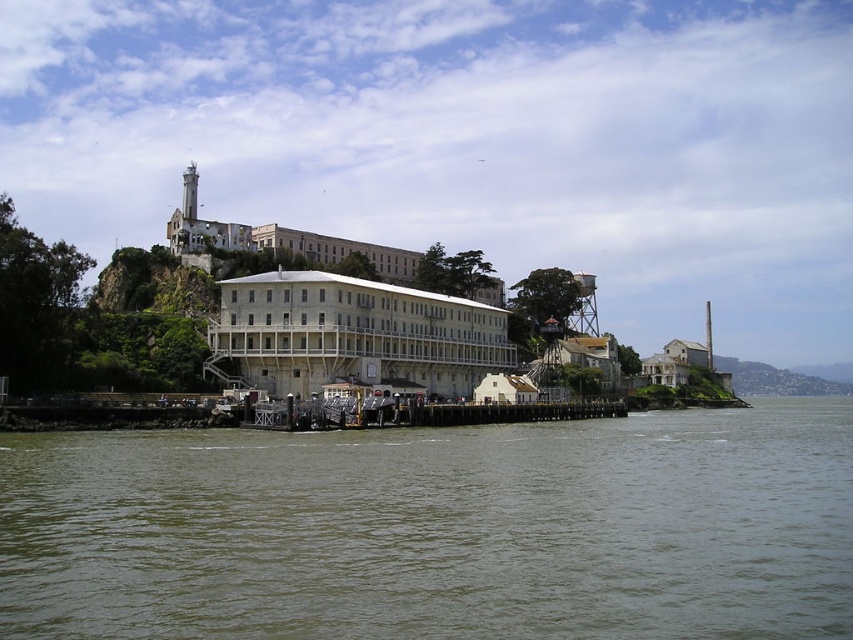
Can you confirm if greenish water at lower center is positioned to the left of white painted wood building at center?

No, greenish water at lower center is not to the left of white painted wood building at center.

Who is lower down, greenish water at lower center or white painted wood building at center?

Positioned lower is greenish water at lower center.

Where is `greenish water at lower center`? The height and width of the screenshot is (640, 853). greenish water at lower center is located at coordinates (438, 529).

Who is more distant from viewer, (360, 304) or (200, 240)?

The point (200, 240) is more distant.

Between white painted wood building at center and white concrete building at center, which one has less height?

white painted wood building at center is shorter.

Is point (244, 317) in front of point (178, 252)?

Yes, it is in front of point (178, 252).

You are a GUI agent. You are given a task and a screenshot of the screen. Output one action in this format:
    pyautogui.click(x=<x>, y=<y>)
    Task: Click on the white painted wood building at center
    
    Given the screenshot: What is the action you would take?
    pyautogui.click(x=352, y=333)

Which is above, greenish water at lower center or white concrete building at center?

Positioned higher is white concrete building at center.

In the scene shown: Who is more forward, (508, 586) or (314, 257)?

Point (508, 586) is in front.

The image size is (853, 640). I want to click on greenish water at lower center, so click(x=438, y=529).